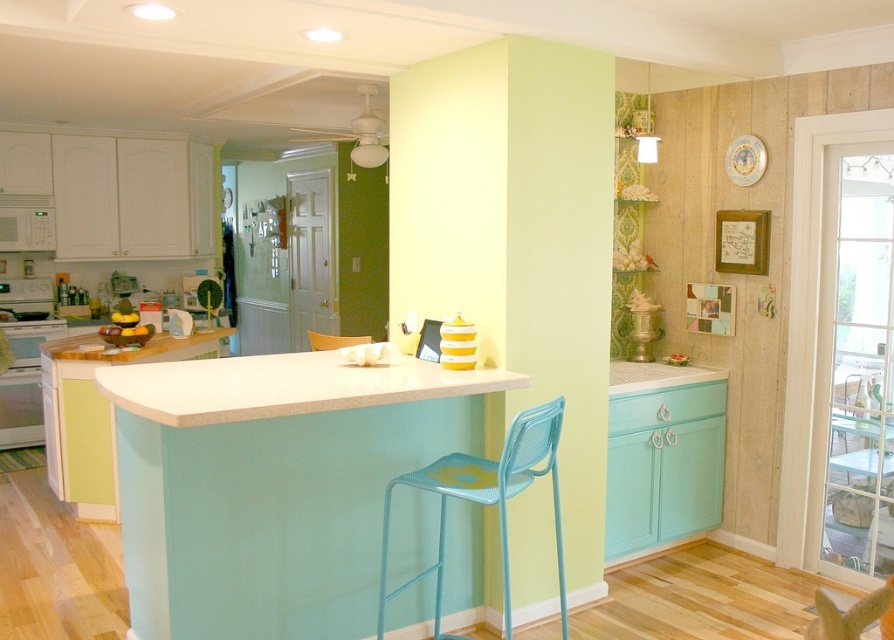
You are a chef who needs to prepare a dish that requires a stable surface. You have a matte turquoise bar at center and a white laminate counter at center available. Which surface would be more suitable for placing heavy items?

The matte turquoise bar at center has a greater height compared to the white laminate counter at center, making it more suitable for placing heavy items as it provides a stable surface at a higher elevation.

You are planning to place a new plant pot in the kitchen. You have two options for placement locations. One is next to the light yellow smooth pillar at center, and the other is next to the matte yellow chair at center. Considering their sizes, which location would provide more space around the plant pot?

Result: The light yellow smooth pillar at center has a larger size compared to the matte yellow chair at center, so placing the plant pot next to the matte yellow chair at center would leave more space around it.

You are standing in the kitchen and want to move from the light yellow smooth pillar at center to the matte yellow chair at center. In which direction should you move to reach the chair?

You should move to the left to reach the matte yellow chair at center because the light yellow smooth pillar at center is to the right of the chair.